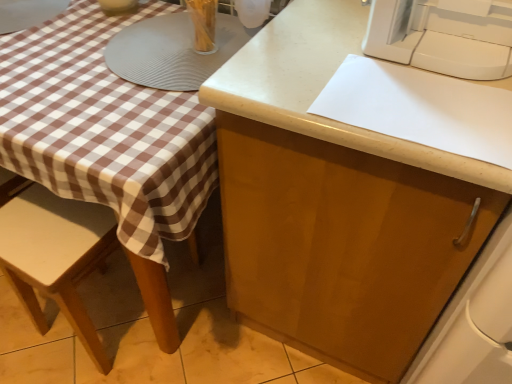
I want to click on vacant region to the left of white plastic sewing machine at upper right, so click(x=314, y=46).